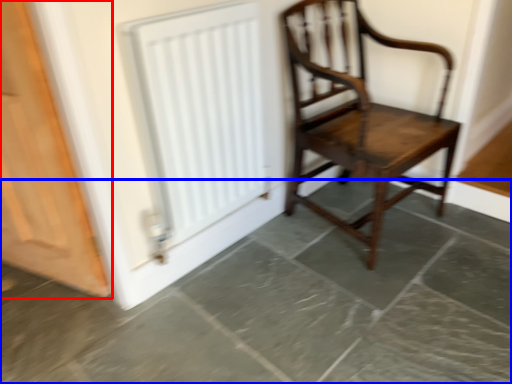
Question: Among these objects, which one is nearest to the camera, door (highlighted by a red box) or concrete (highlighted by a blue box)?

Choices:
 (A) door
 (B) concrete

Answer: (B)